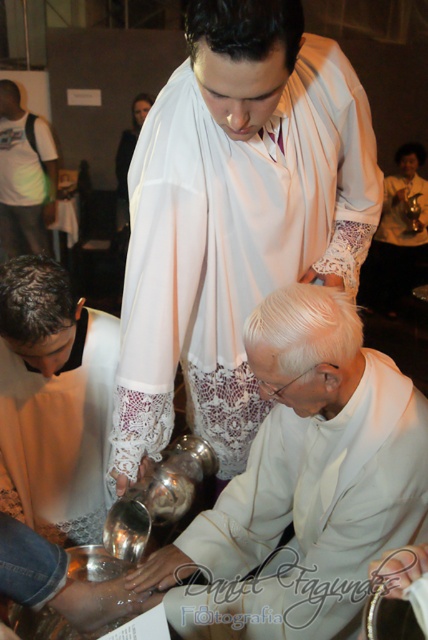
Who is taller, white matte glass at center or matte white robe at lower left?

Standing taller between the two is white matte glass at center.

Who is higher up, white matte glass at center or matte white robe at lower left?

white matte glass at center is above.

Which is behind, point (234, 547) or point (107, 372)?

The point (107, 372) is behind.

Where is `white matte glass at center`? This screenshot has height=640, width=428. white matte glass at center is located at coordinates (306, 477).

Between point (326, 97) and point (282, 628), which one is positioned behind?

The point (326, 97) is more distant.

Can you confirm if white lace cloth at center is shorter than white matte glass at center?

In fact, white lace cloth at center may be taller than white matte glass at center.

Is point (300, 218) farther from viewer compared to point (398, 472)?

That is True.

The image size is (428, 640). In order to click on white lace cloth at center in this screenshot , I will do `click(234, 216)`.

Between point (259, 547) and point (29, 200), which one is positioned in front?

Point (259, 547)

Is white matte glass at center shorter than white t-shirt at left?

Yes.

Where is `white matte glass at center`? The height and width of the screenshot is (640, 428). white matte glass at center is located at coordinates (306, 477).